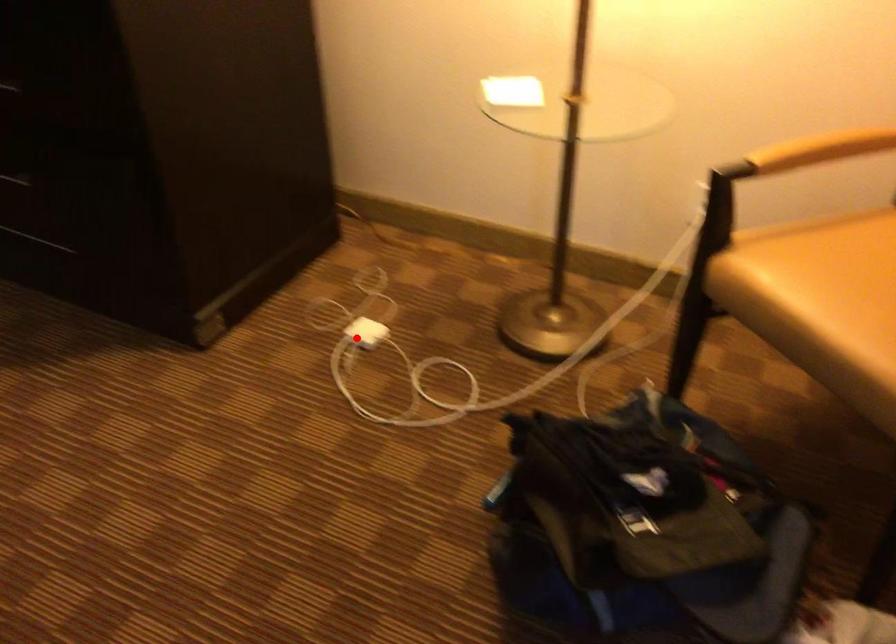
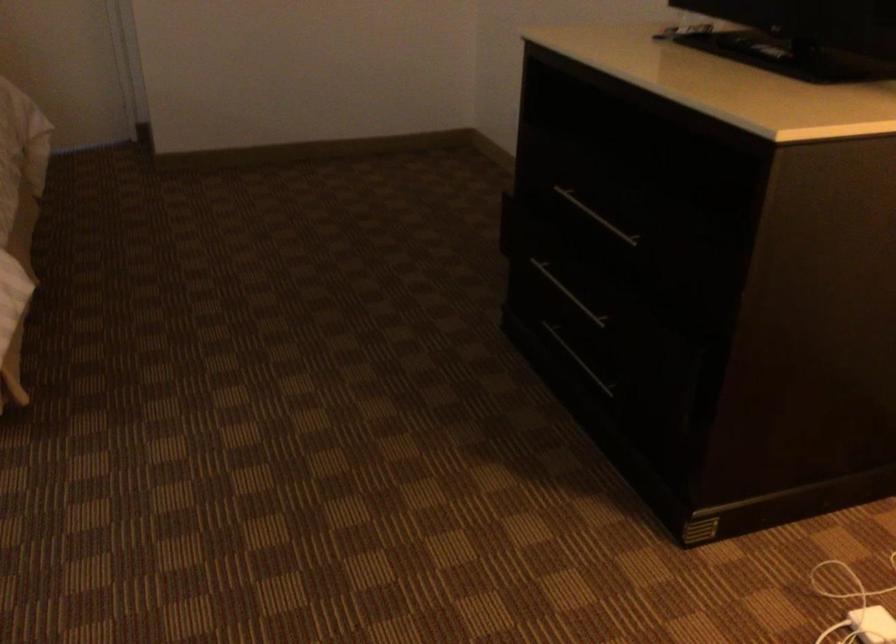
Question: I am providing you with two images of the same scene from different viewpoints. A red point is marked on the first image. At the location where the point appears in image 1, is it still visible in image 2?

Choices:
 (A) Yes
 (B) No

Answer: (A)